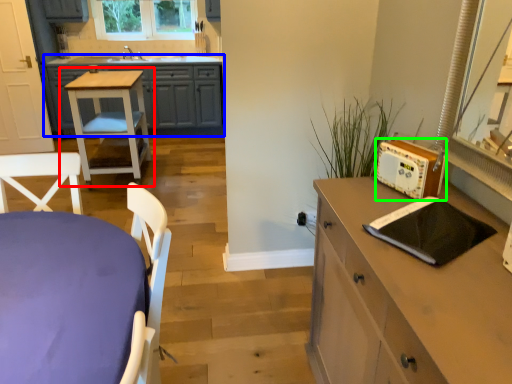
Question: Which is farther away from table (highlighted by a red box)? cabinetry (highlighted by a blue box) or appliance (highlighted by a green box)?

Choices:
 (A) cabinetry
 (B) appliance

Answer: (B)